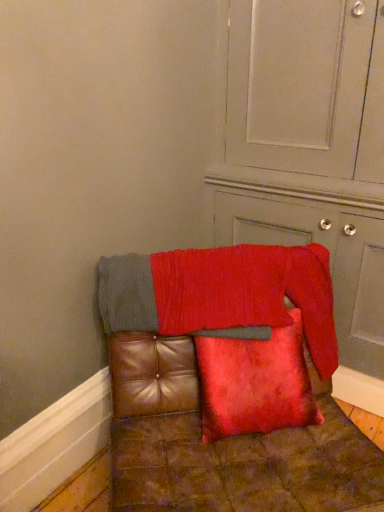
Question: Is red textured blanket at center closer to the viewer compared to velvet red pillow at center?

Choices:
 (A) no
 (B) yes

Answer: (A)

Question: Is red textured blanket at center facing towards velvet red pillow at center?

Choices:
 (A) no
 (B) yes

Answer: (B)

Question: Does red textured blanket at center appear on the right side of velvet red pillow at center?

Choices:
 (A) no
 (B) yes

Answer: (A)

Question: Is red textured blanket at center further to the viewer compared to velvet red pillow at center?

Choices:
 (A) no
 (B) yes

Answer: (B)

Question: Is red textured blanket at center outside velvet red pillow at center?

Choices:
 (A) yes
 (B) no

Answer: (A)

Question: Could velvet red pillow at center be considered to be inside red textured blanket at center?

Choices:
 (A) no
 (B) yes

Answer: (A)

Question: Is leather cushion at center inside velvet red pillow at center?

Choices:
 (A) no
 (B) yes

Answer: (A)

Question: Can you confirm if velvet red pillow at center is shorter than leather cushion at center?

Choices:
 (A) yes
 (B) no

Answer: (A)

Question: Considering the relative positions of velvet red pillow at center and leather cushion at center in the image provided, is velvet red pillow at center to the right of leather cushion at center from the viewer's perspective?

Choices:
 (A) yes
 (B) no

Answer: (A)

Question: Is velvet red pillow at center taller than leather cushion at center?

Choices:
 (A) no
 (B) yes

Answer: (A)

Question: Is velvet red pillow at center beside leather cushion at center?

Choices:
 (A) yes
 (B) no

Answer: (A)

Question: Is velvet red pillow at center oriented away from leather cushion at center?

Choices:
 (A) yes
 (B) no

Answer: (A)

Question: Is red textured blanket at center positioned in front of velvet red cushion at lower right?

Choices:
 (A) no
 (B) yes

Answer: (A)